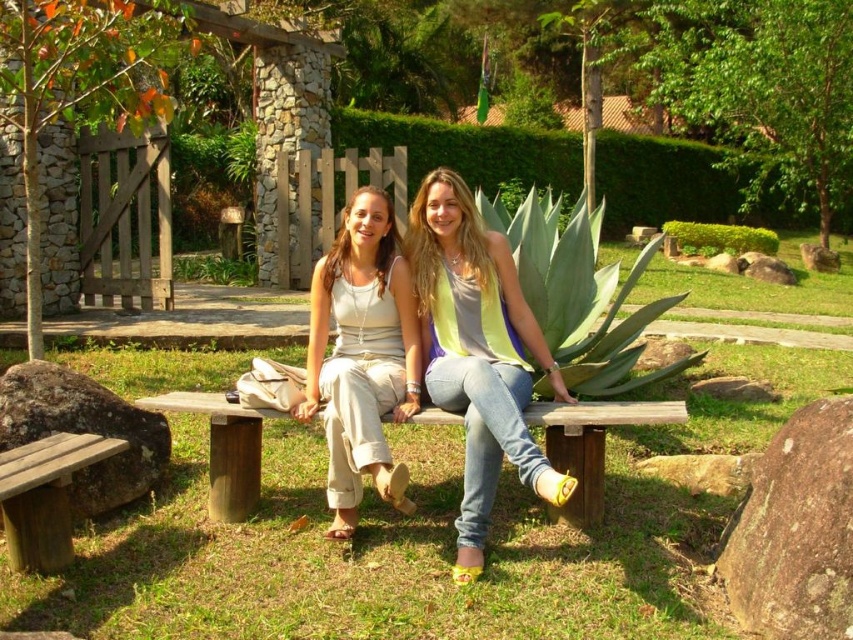
Question: Which point appears farthest from the camera in this image?

Choices:
 (A) (84, 458)
 (B) (344, 237)
 (C) (842, 572)

Answer: (B)

Question: Is beige cotton tank top at center wider than wooden bench at center?

Choices:
 (A) yes
 (B) no

Answer: (B)

Question: Which point appears closest to the camera in this image?

Choices:
 (A) (183, 392)
 (B) (32, 381)
 (C) (843, 404)

Answer: (C)

Question: Observing the image, what is the correct spatial positioning of wooden bench at center in reference to wooden bench at lower left?

Choices:
 (A) right
 (B) left

Answer: (A)

Question: Is wooden bench at center to the right of brown wooden bench at lower left from the viewer's perspective?

Choices:
 (A) yes
 (B) no

Answer: (A)

Question: Considering the real-world distances, which object is closest to the beige cotton tank top at center?

Choices:
 (A) wooden bench at center
 (B) brown wooden bench at lower left

Answer: (A)